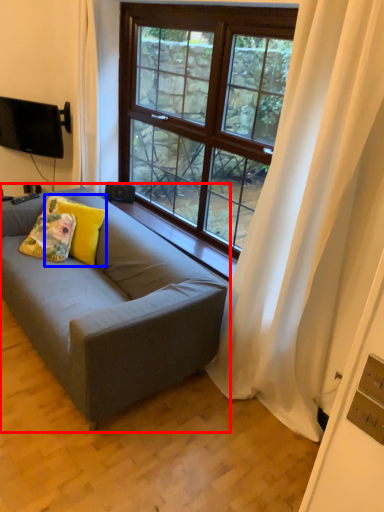
Question: Which point is closer to the camera, studio couch (highlighted by a red box) or pillow (highlighted by a blue box)?

Choices:
 (A) studio couch
 (B) pillow

Answer: (A)